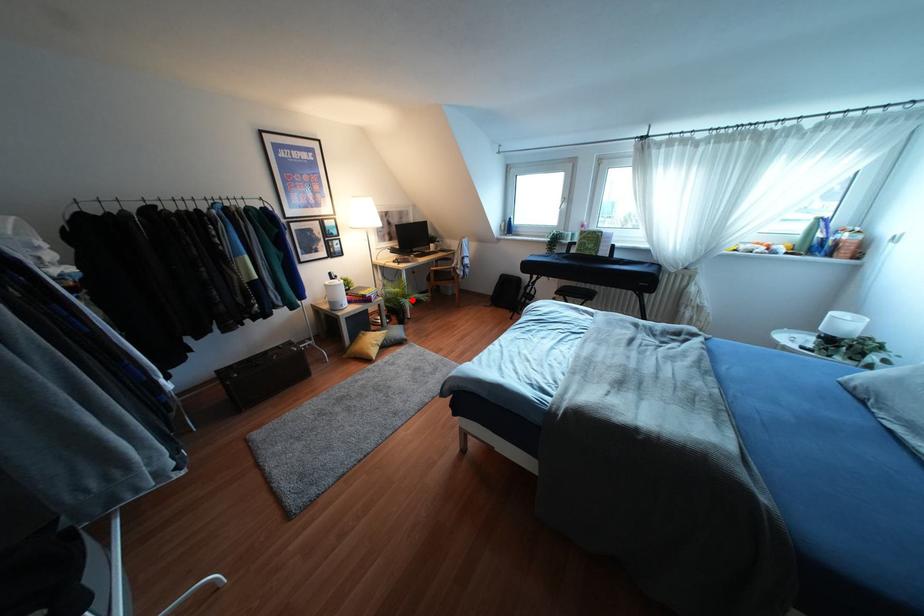
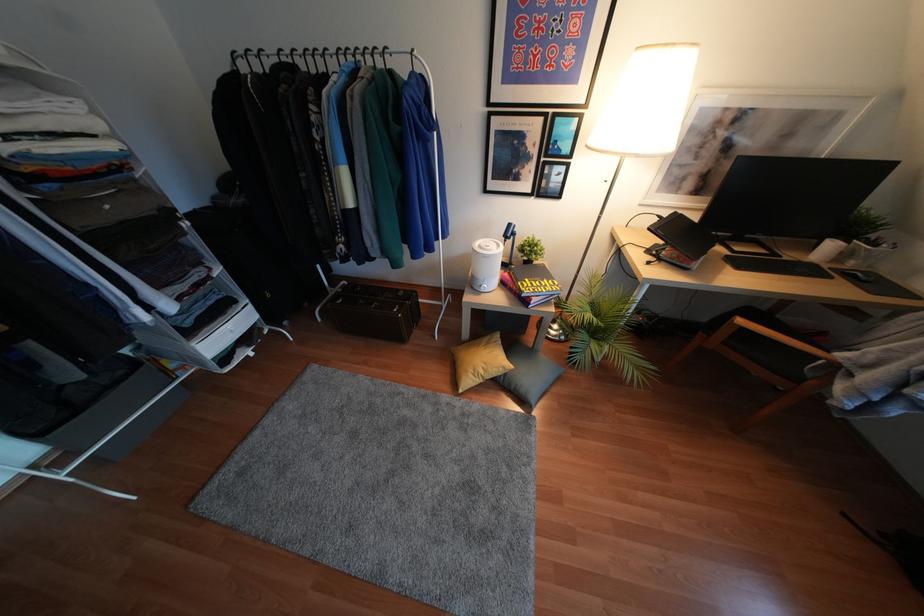
Where in the second image is the point corresponding to the highlighted location from the first image?

(604, 357)